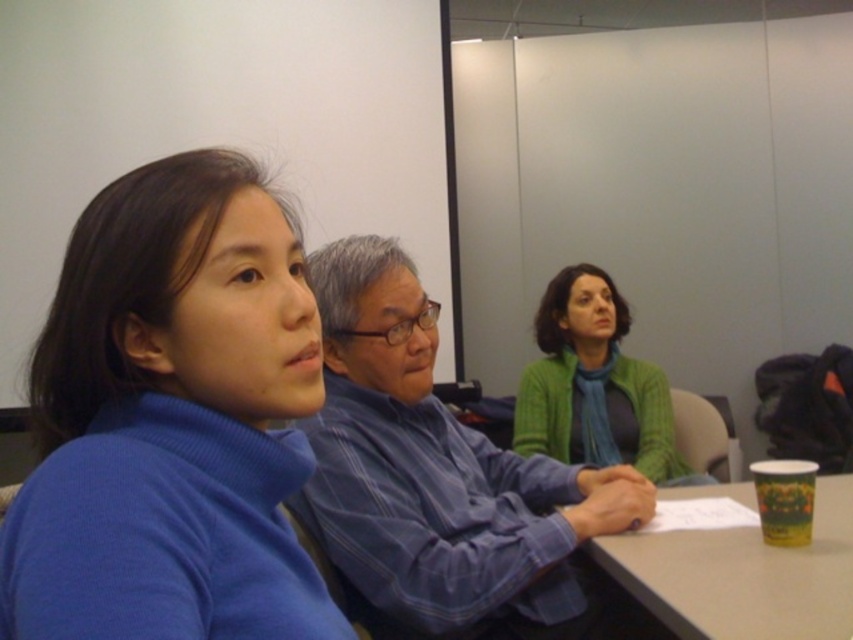
You are a photographer setting up a camera to take a group photo of the blue striped shirt at center and the green knitted sweater at center. The camera has a minimum focus distance of 30 inches. Will both subjects be in focus if you position the camera exactly between them?

The blue striped shirt at center and green knitted sweater at center are 32.22 inches apart. Positioning the camera exactly between them would mean each subject is 16.11 inches away from the camera. Since the minimum focus distance is 30 inches, the subjects are too close to be in focus. Adjust the camera position to ensure they are at least 30 inches away.